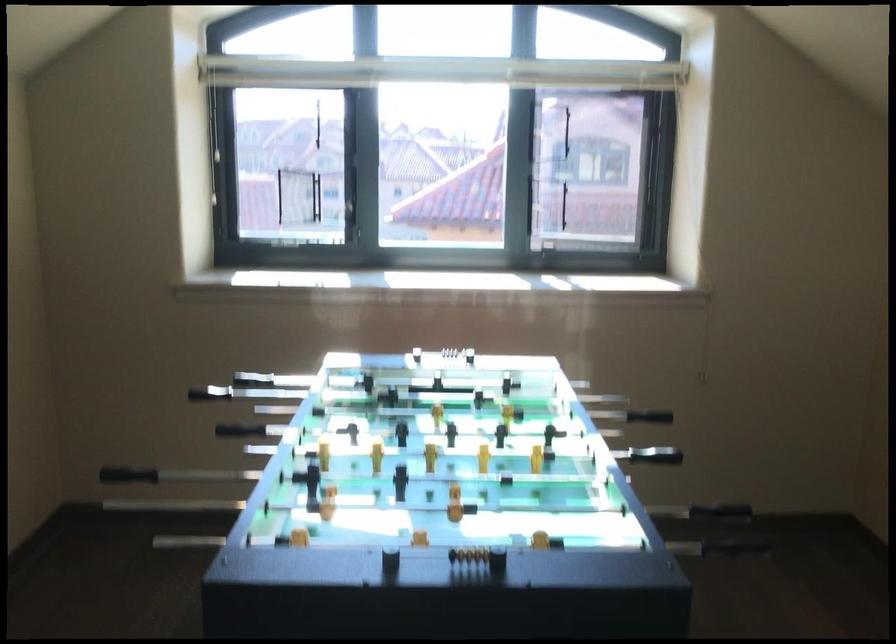
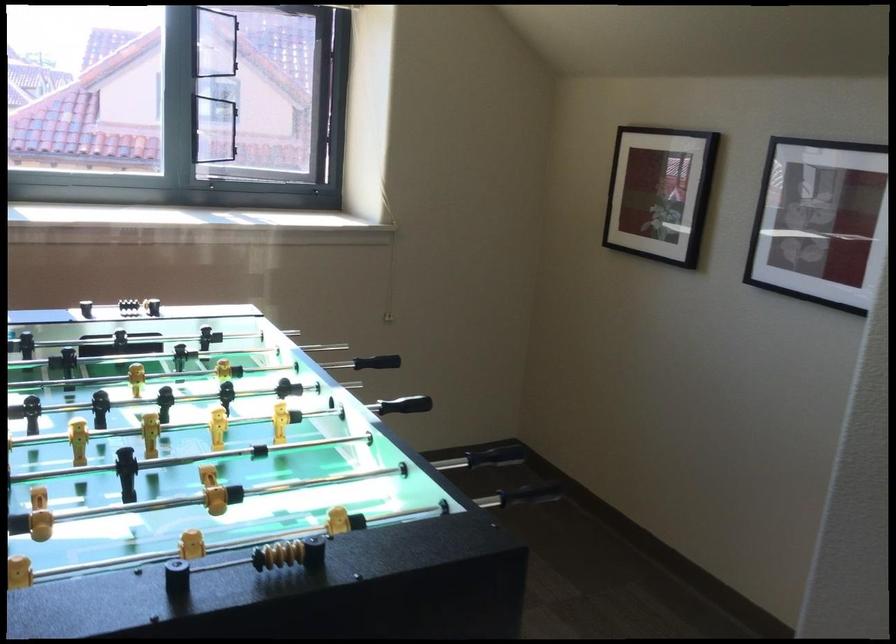
Where in the second image is the point corresponding to point (719, 468) from the first image?

(406, 404)